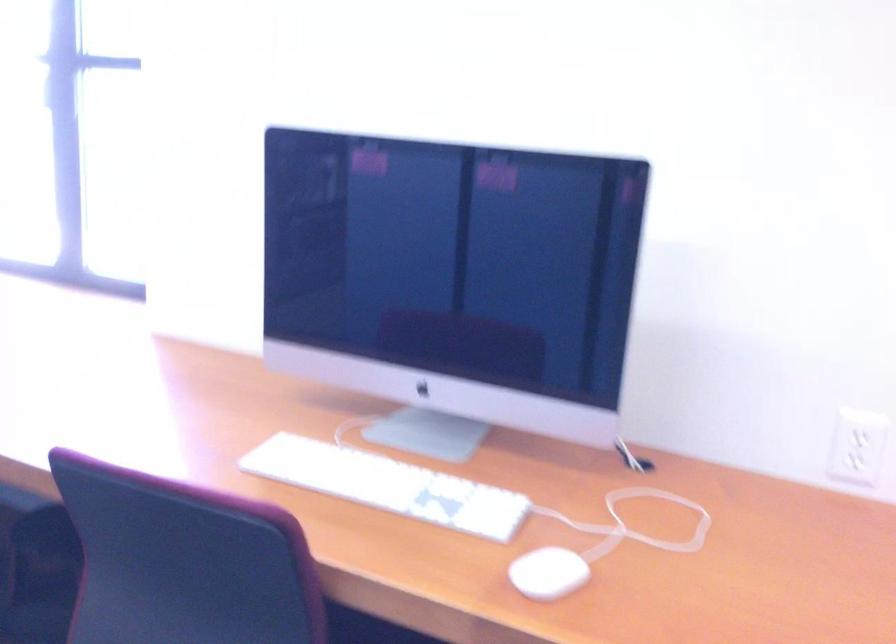
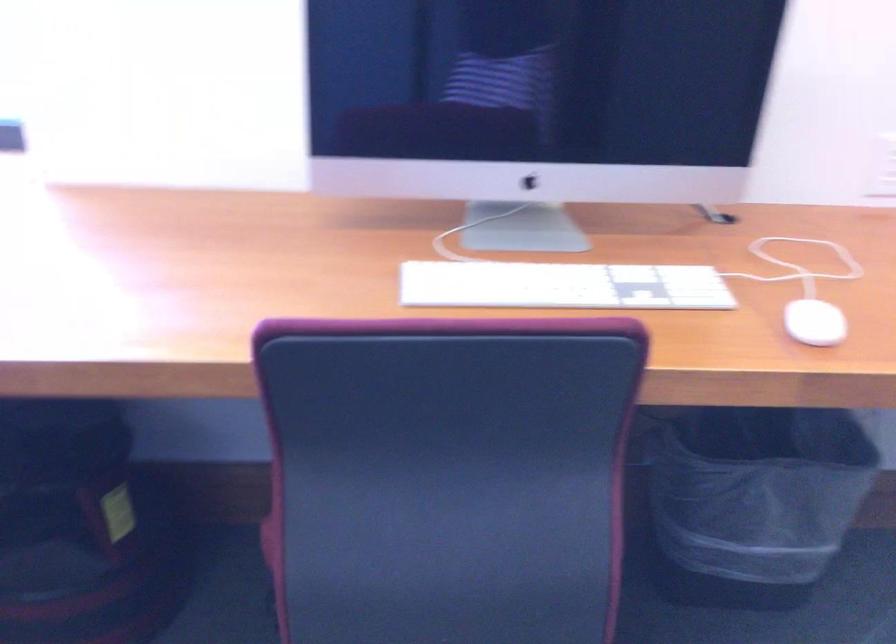
Where in the second image is the point corresponding to point 375,486 from the first image?

(562, 285)